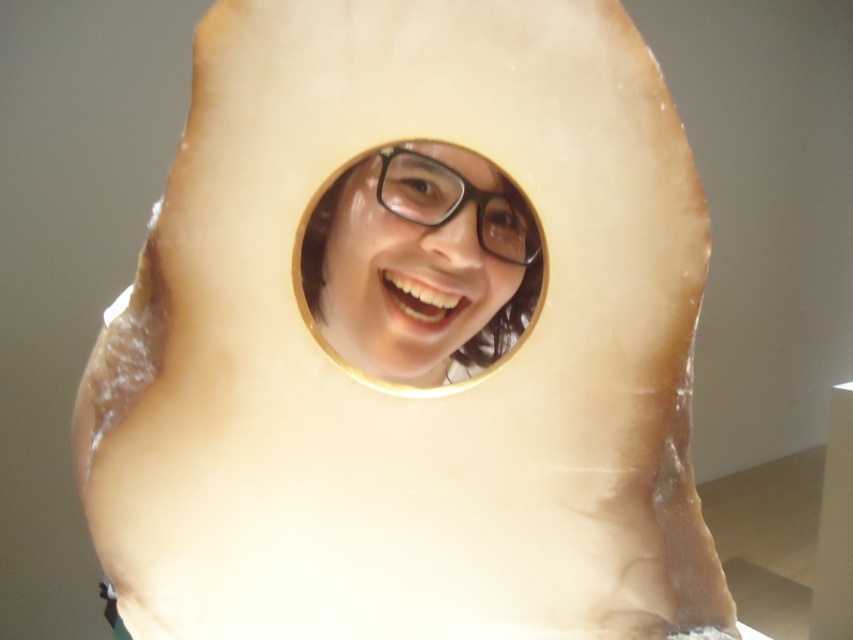
Can you confirm if matte black glasses at center is bigger than black plastic glasses at center?

Correct, matte black glasses at center is larger in size than black plastic glasses at center.

Is matte black glasses at center shorter than black plastic glasses at center?

In fact, matte black glasses at center may be taller than black plastic glasses at center.

The height and width of the screenshot is (640, 853). Find the location of `matte black glasses at center`. matte black glasses at center is located at coordinates (416, 260).